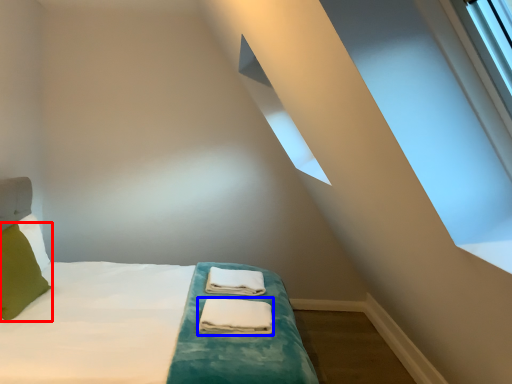
Question: Which object appears closest to the camera in this image, pillow (highlighted by a red box) or material (highlighted by a blue box)?

Choices:
 (A) pillow
 (B) material

Answer: (A)